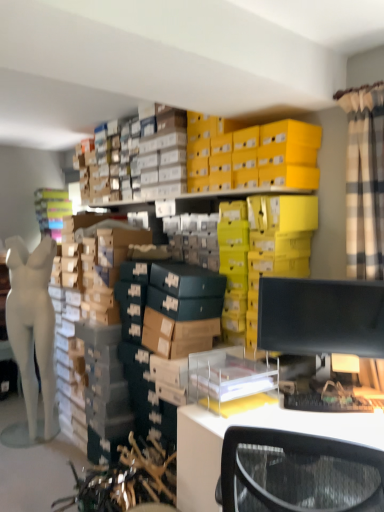
Where is `white plastic desk at lower right`? This screenshot has height=512, width=384. white plastic desk at lower right is located at coordinates (251, 425).

From a real-world perspective, which object stands above the other?

black matte monitor at right, from a real-world perspective.

Can you confirm if black matte monitor at right is bigger than white plastic desk at lower right?

No.

From the picture: Is black matte monitor at right facing towards white plastic desk at lower right?

No, black matte monitor at right does not turn towards white plastic desk at lower right.

Which is behind, black matte monitor at right or white plastic desk at lower right?

black matte monitor at right is more distant.

From a real-world perspective, is black matte monitor at right physically below white matte mannequin at left?

No, from a real-world perspective, black matte monitor at right is not below white matte mannequin at left.

Can you confirm if black matte monitor at right is bigger than white matte mannequin at left?

Incorrect, black matte monitor at right is not larger than white matte mannequin at left.

Is black matte monitor at right surrounding white matte mannequin at left?

Definitely not — white matte mannequin at left is not inside black matte monitor at right.

Where is `person below the black matte monitor at right (from a real-world perspective)`? person below the black matte monitor at right (from a real-world perspective) is located at coordinates (33, 326).

From a real-world perspective, is white matte mannequin at left physically located above or below white plastic desk at lower right?

white matte mannequin at left is above white plastic desk at lower right.

Which of these two, white matte mannequin at left or white plastic desk at lower right, is smaller?

With smaller size is white matte mannequin at left.

Which is correct: white matte mannequin at left is inside white plastic desk at lower right, or outside of it?

white matte mannequin at left is outside white plastic desk at lower right.

Is white matte mannequin at left to the right of black matte monitor at right from the viewer's perspective?

No, white matte mannequin at left is not to the right of black matte monitor at right.

Based on the photo, considering the sizes of objects white matte mannequin at left and black matte monitor at right in the image provided, who is taller, white matte mannequin at left or black matte monitor at right?

Standing taller between the two is white matte mannequin at left.

What's the angular difference between white matte mannequin at left and black matte monitor at right's facing directions?

white matte mannequin at left and black matte monitor at right are facing 13 degrees away from each other.

Is white matte mannequin at left looking in the opposite direction of black matte monitor at right?

white matte mannequin at left is not turned away from black matte monitor at right.

Is white matte mannequin at left a part of white plastic desk at lower right?

No, white plastic desk at lower right does not contain white matte mannequin at left.

From a real-world perspective, relative to white matte mannequin at left, is white plastic desk at lower right vertically above or below?

From a real-world perspective, white plastic desk at lower right is physically below white matte mannequin at left.

Locate an element on the screen. desk on the right of white matte mannequin at left is located at coordinates (251, 425).

From the picture: Is white plastic desk at lower right turned away from black matte monitor at right?

No.

From the picture: Considering the positions of objects white plastic desk at lower right and black matte monitor at right in the image provided, who is in front, white plastic desk at lower right or black matte monitor at right?

white plastic desk at lower right.

From the image's perspective, is white plastic desk at lower right positioned above or below black matte monitor at right?

white plastic desk at lower right is below black matte monitor at right.

Is white plastic desk at lower right not within black matte monitor at right?

Indeed, white plastic desk at lower right is completely outside black matte monitor at right.

Find the location of a particular element. desktop computer on the right of the white plastic desk at lower right is located at coordinates (321, 316).

Image resolution: width=384 pixels, height=512 pixels. Identify the location of desktop computer that appears above the white matte mannequin at left (from the image's perspective). (321, 316).

Looking at the image, which one is located closer to black matte monitor at right, white matte mannequin at left or white plastic desk at lower right?

white plastic desk at lower right is closer to black matte monitor at right.

Which object lies further to the anchor point white plastic desk at lower right, black matte monitor at right or white matte mannequin at left?

white matte mannequin at left.

Looking at the image, which one is located closer to white plastic desk at lower right, white matte mannequin at left or black matte monitor at right?

black matte monitor at right is closer to white plastic desk at lower right.

Which object lies further to the anchor point white matte mannequin at left, black matte monitor at right or white plastic desk at lower right?

Among the two, black matte monitor at right is located further to white matte mannequin at left.

Considering their positions, is white plastic desk at lower right positioned further to black matte monitor at right than white matte mannequin at left?

white matte mannequin at left.

Which object lies nearer to the anchor point white matte mannequin at left, white plastic desk at lower right or black matte monitor at right?

white plastic desk at lower right is positioned closer to the anchor white matte mannequin at left.

The height and width of the screenshot is (512, 384). I want to click on desk located between white matte mannequin at left and black matte monitor at right in the left-right direction, so click(x=251, y=425).